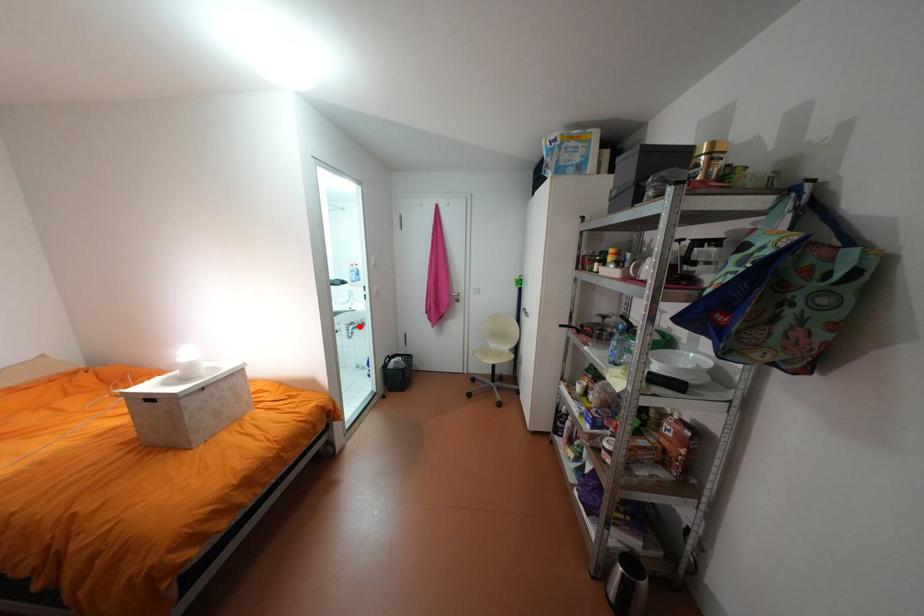
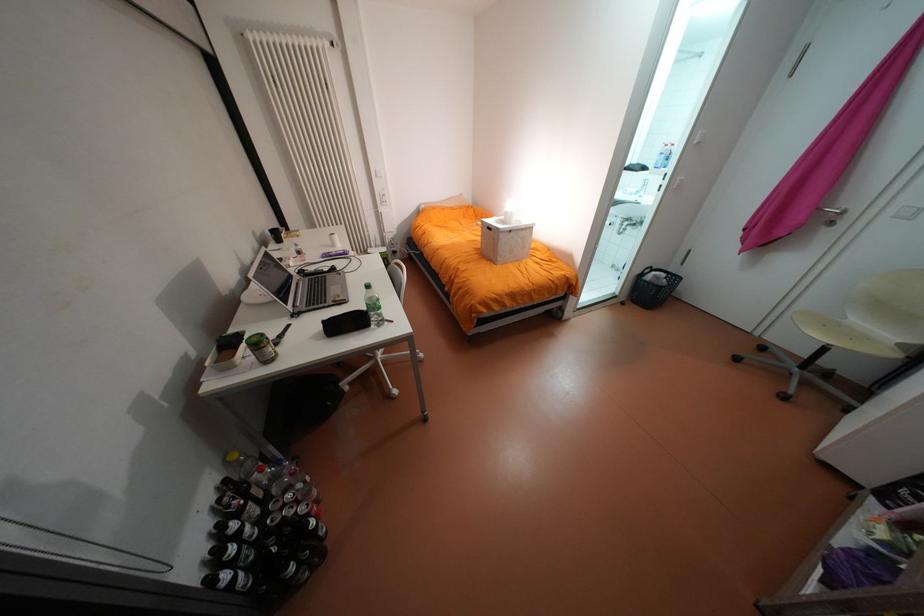
The point at the highlighted location is marked in the first image. Where is the corresponding point in the second image?

(636, 223)